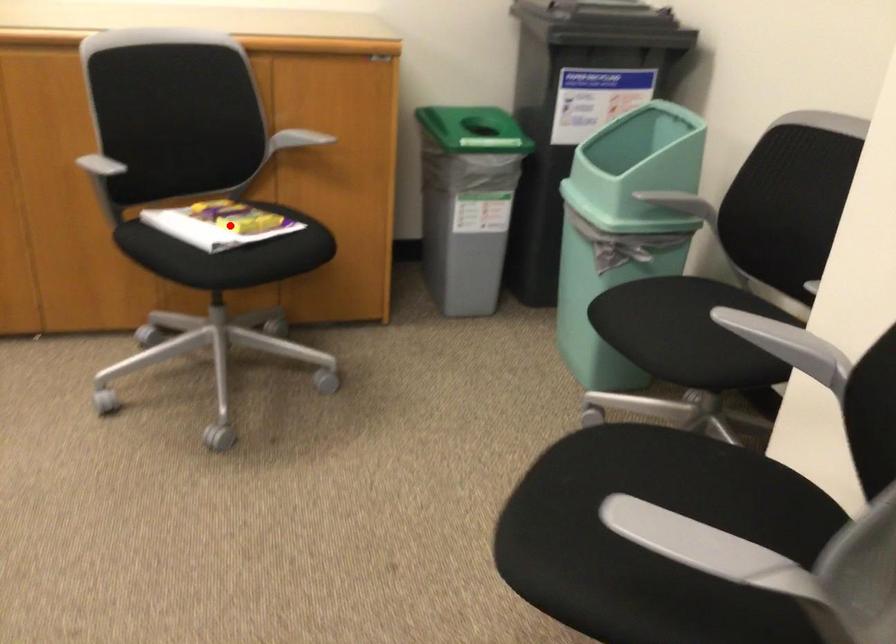
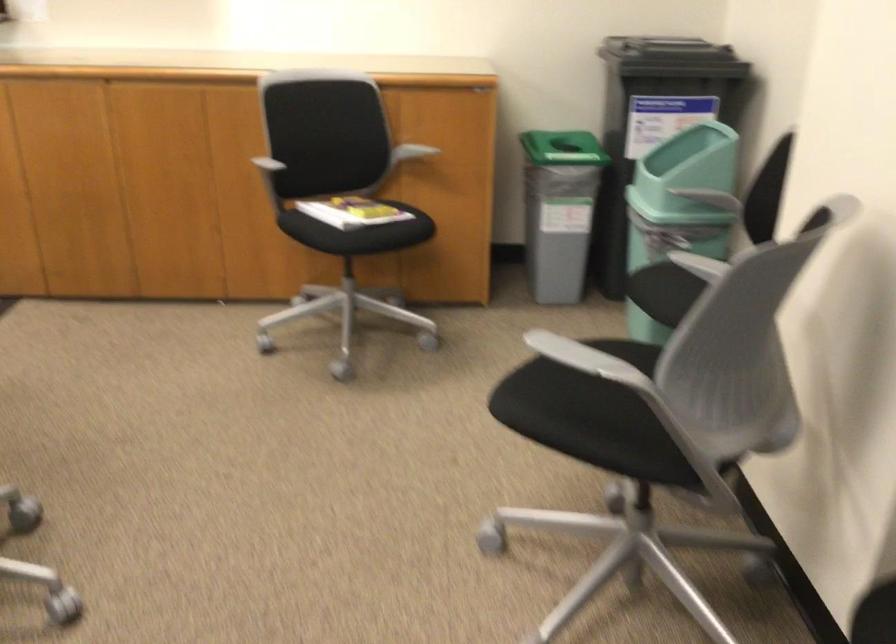
Where in the second image is the point corresponding to the highlighted location from the first image?

(355, 212)